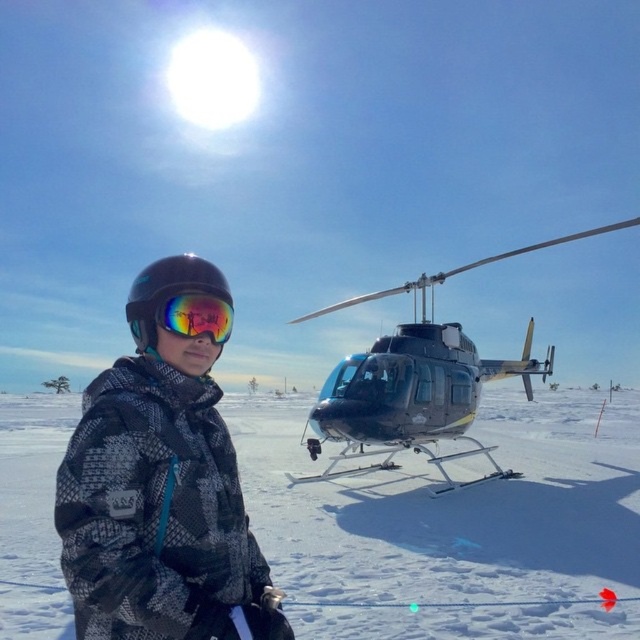
Does rimless reflective helmet at center appear under reflective mirrored goggles at center?

Actually, rimless reflective helmet at center is above reflective mirrored goggles at center.

Who is more distant from viewer, (140,339) or (161,308)?

Positioned behind is point (140,339).

Locate an element on the screen. The height and width of the screenshot is (640, 640). rimless reflective helmet at center is located at coordinates (179, 304).

What do you see at coordinates (452, 506) in the screenshot?
I see `white snow at center` at bounding box center [452, 506].

Can you confirm if white snow at center is smaller than camouflage jacket at center?

Actually, white snow at center might be larger than camouflage jacket at center.

Measure the distance between white snow at center and camera.

white snow at center and camera are 10.47 feet apart from each other.

This screenshot has height=640, width=640. I want to click on white snow at center, so click(452, 506).

Does white snow at center come behind reflective mirrored goggles at center?

Yes, it is behind reflective mirrored goggles at center.

Is point (24, 416) behind point (180, 294)?

Yes.

This screenshot has width=640, height=640. I want to click on white snow at center, so click(452, 506).